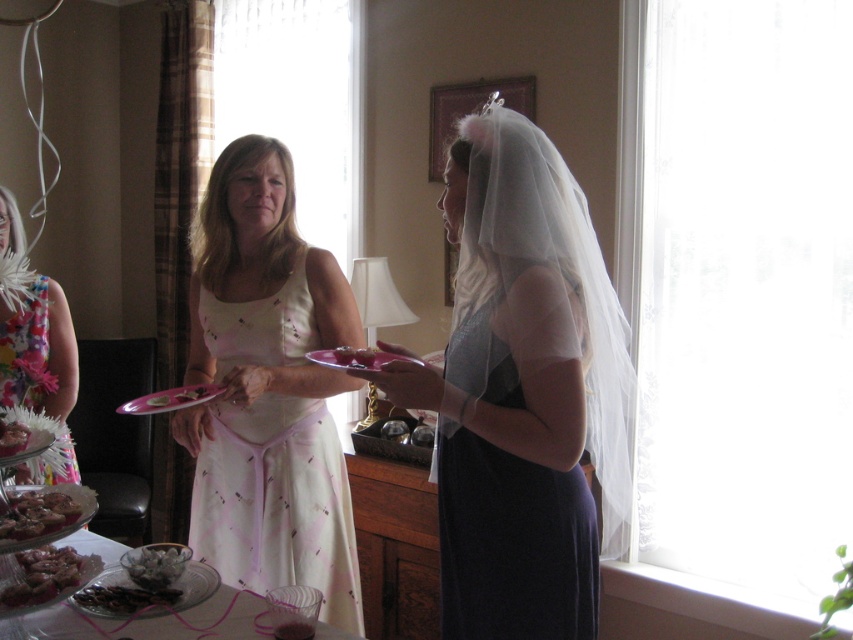
Which is more to the right, pink plastic platter at center or pink plastic plate at center?

pink plastic plate at center is more to the right.

Does pink plastic platter at center lie behind pink plastic plate at center?

Yes, pink plastic platter at center is further from the viewer.

Which is behind, point (212, 390) or point (315, 356)?

Point (212, 390)

In order to click on pink plastic platter at center in this screenshot , I will do `click(170, 400)`.

Does pink plastic platter at center appear on the left side of pink glossy plate at center?

Indeed, pink plastic platter at center is positioned on the left side of pink glossy plate at center.

Which is behind, point (190, 404) or point (354, 353)?

Point (190, 404)

Identify the location of pink plastic platter at center. This screenshot has height=640, width=853. (170, 400).

Between floral fabric dress at left and translucent glass bowl at lower left, which one has less height?

Standing shorter between the two is translucent glass bowl at lower left.

Is point (3, 369) farther from camera compared to point (144, 570)?

Yes, it is.

Locate an element on the screen. The width and height of the screenshot is (853, 640). floral fabric dress at left is located at coordinates (38, 352).